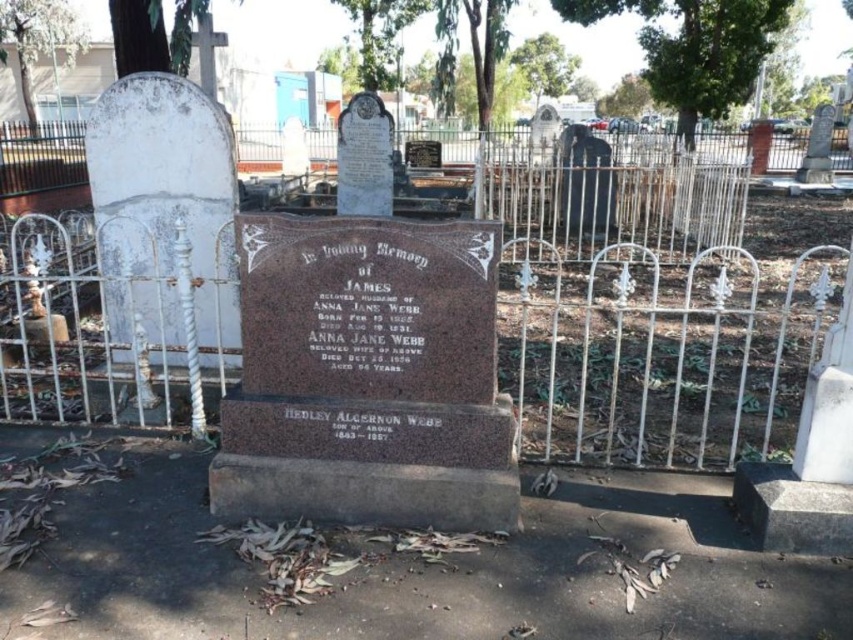
Question: Is white wrought iron fence at center closer to camera compared to brown polished stone gravestone at center?

Choices:
 (A) yes
 (B) no

Answer: (B)

Question: Which object appears farthest from the camera in this image?

Choices:
 (A) white wrought iron fence at center
 (B) brown polished stone gravestone at center

Answer: (A)

Question: Is white wrought iron fence at center below brown polished stone gravestone at center?

Choices:
 (A) yes
 (B) no

Answer: (B)

Question: Can you confirm if white wrought iron fence at center is positioned to the right of brown polished stone gravestone at center?

Choices:
 (A) yes
 (B) no

Answer: (B)

Question: Which point is farther to the camera?

Choices:
 (A) (339, 266)
 (B) (65, 244)

Answer: (B)

Question: Among these objects, which one is nearest to the camera?

Choices:
 (A) white wrought iron fence at center
 (B) brown polished stone gravestone at center

Answer: (B)